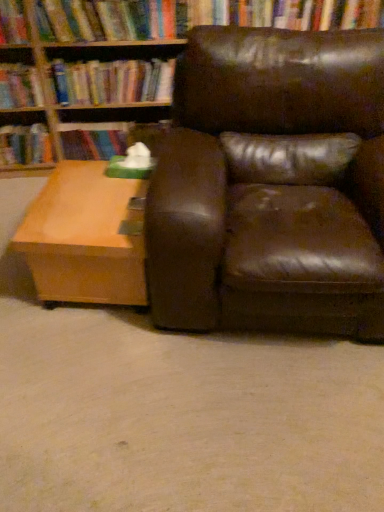
Question: Considering the positions of point (122, 268) and point (6, 100), is point (122, 268) closer or farther from the camera than point (6, 100)?

Choices:
 (A) closer
 (B) farther

Answer: (A)

Question: Looking at their shapes, would you say light brown wood coffee table at lower left is wider or thinner than hardcover book at upper left, which is the 3th book from right to left?

Choices:
 (A) wide
 (B) thin

Answer: (A)

Question: Which object is positioned farthest from the hardcover book at center, the 3th book when ordered from left to right?

Choices:
 (A) hardcover book at upper center, which is the first book in right-to-left order
 (B) light brown wood coffee table at lower left
 (C) hardcover book at upper left, which is the second book in left-to-right order
 (D) brown leather chair at center
 (E) hardcover book at left, arranged as the 4th book when viewed from the right

Answer: (D)

Question: Considering the real-world distances, which object is closest to the hardcover book at center, which appears as the 2th book when viewed from the right?

Choices:
 (A) hardcover book at upper center, which is the first book in right-to-left order
 (B) light brown wood coffee table at lower left
 (C) hardcover book at left, arranged as the 4th book when viewed from the right
 (D) hardcover book at upper left, which is the second book in left-to-right order
 (E) brown leather chair at center

Answer: (A)